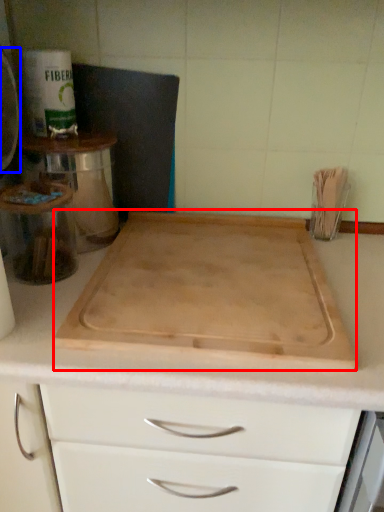
Question: Among these objects, which one is farthest to the camera, cutting board (highlighted by a red box) or appliance (highlighted by a blue box)?

Choices:
 (A) cutting board
 (B) appliance

Answer: (B)